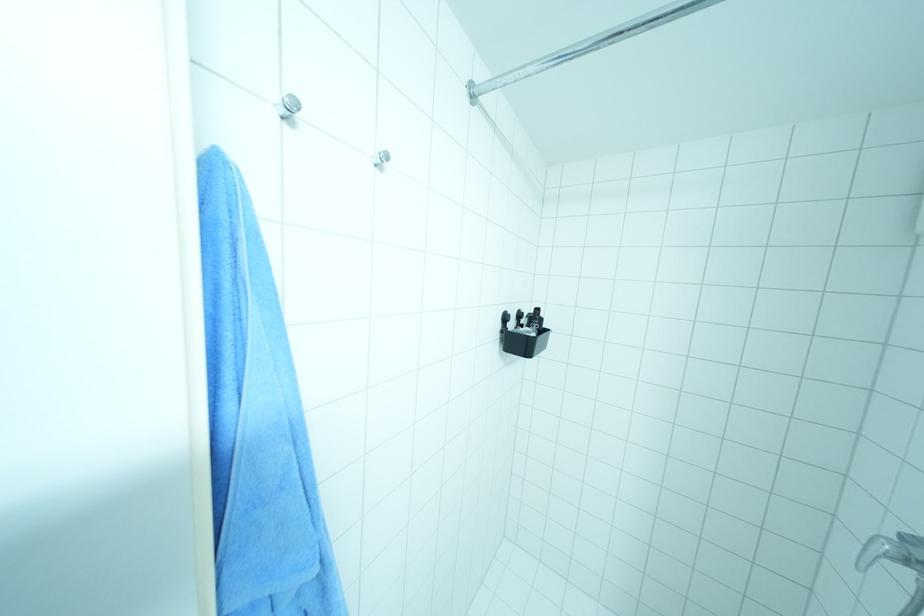
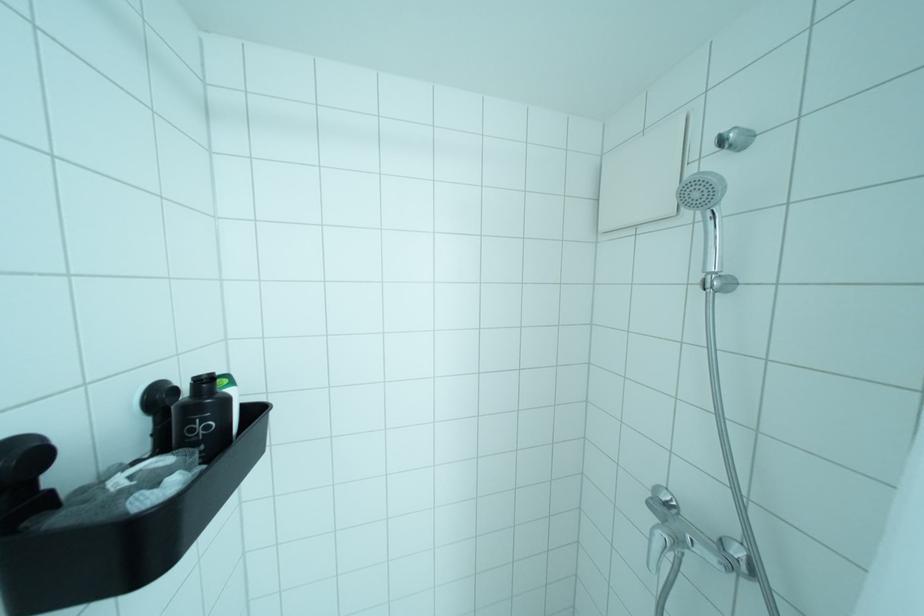
Question: How did the camera likely rotate?

Choices:
 (A) Left
 (B) Right
 (C) Up
 (D) Down

Answer: (B)